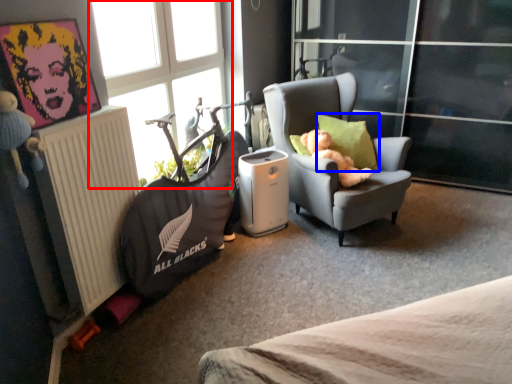
Question: Which of the following is the closest to the observer, window (highlighted by a red box) or pillow (highlighted by a blue box)?

Choices:
 (A) window
 (B) pillow

Answer: (A)